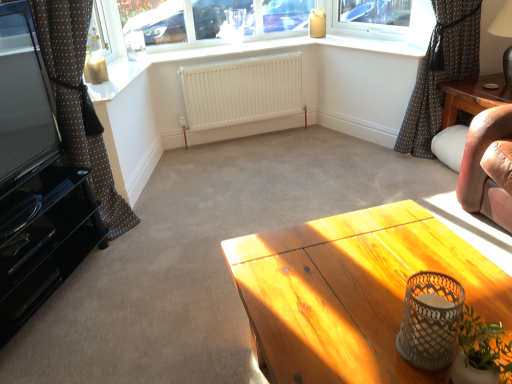
Where is `empty space that is ontop of white matte radiator at center (from a real-world perspective)`? empty space that is ontop of white matte radiator at center (from a real-world perspective) is located at coordinates (242, 63).